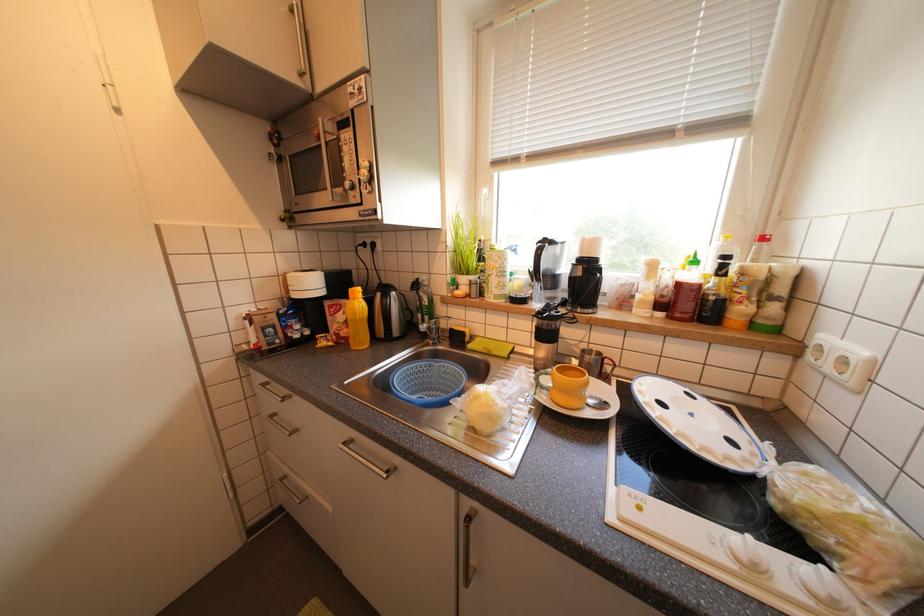
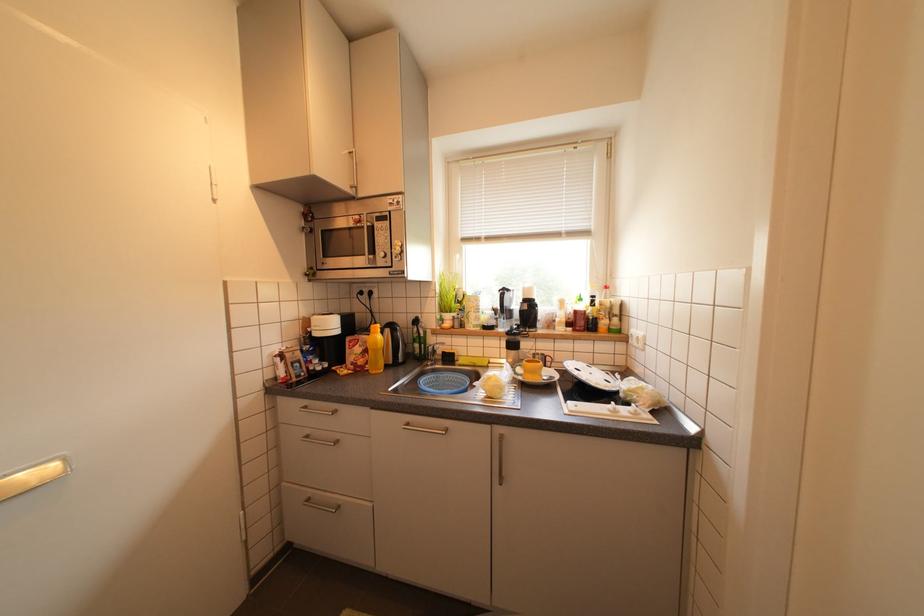
Which direction would the cameraman need to move to produce the second image?

The movement direction of the cameraman is left, backward.